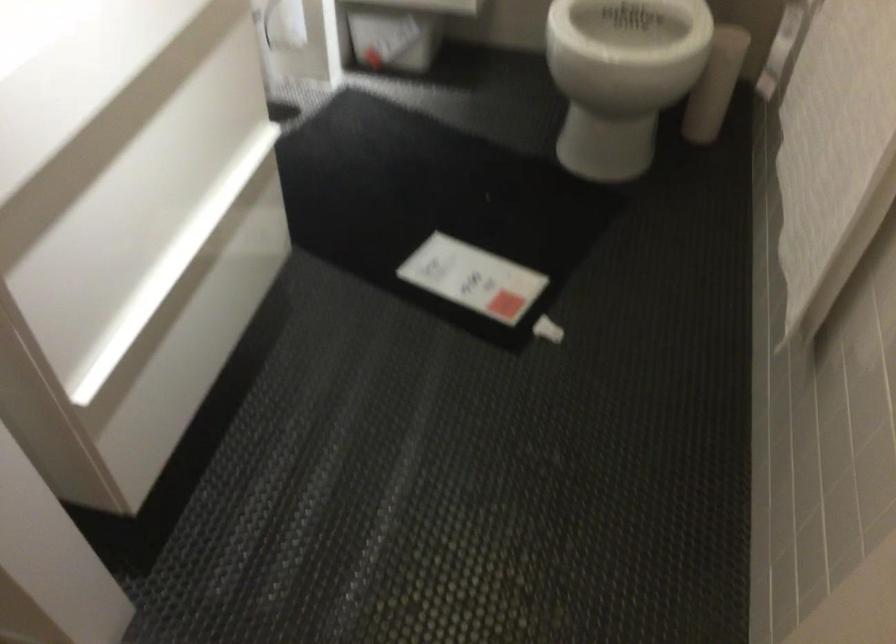
Locate an element on the screen. The width and height of the screenshot is (896, 644). white paper tag is located at coordinates (472, 278).